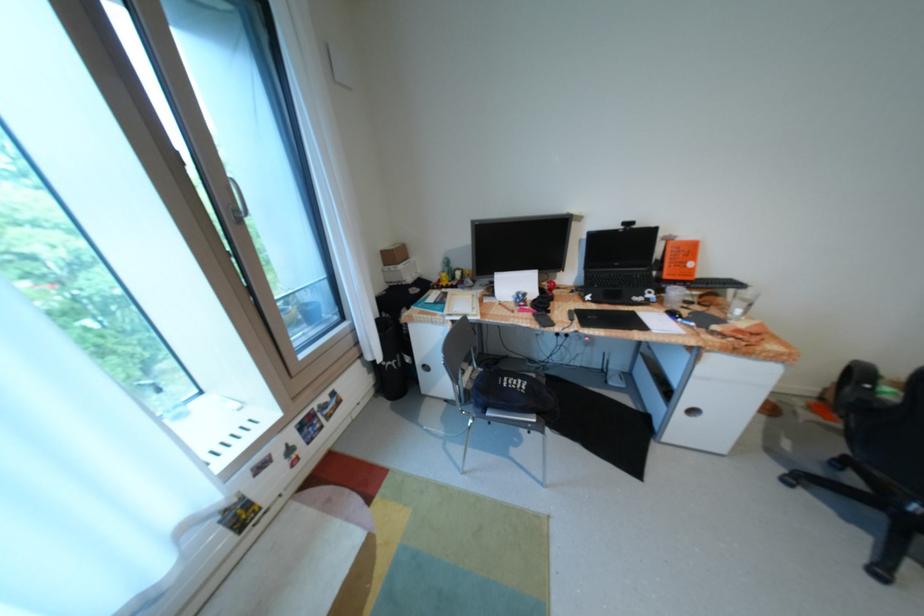
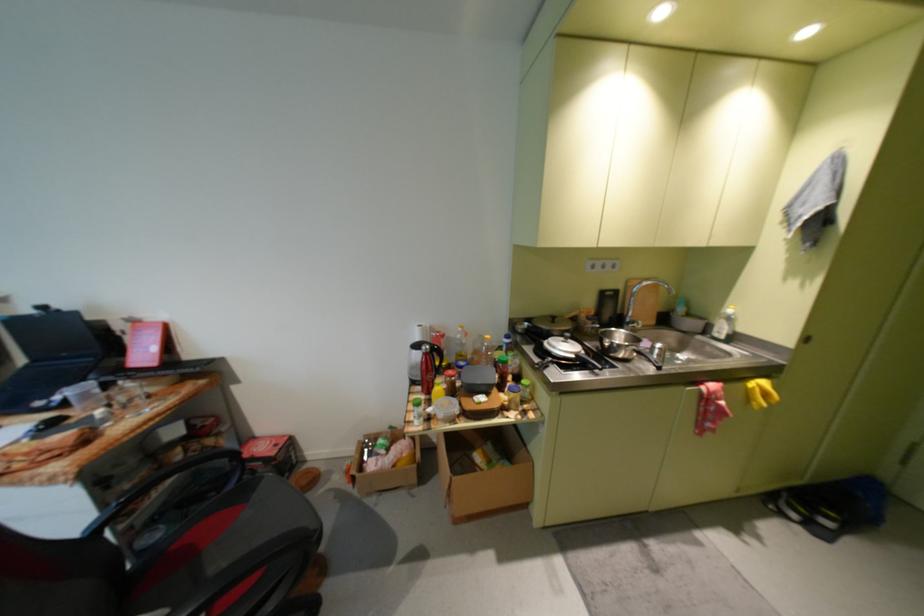
Question: Which direction would the cameraman need to move to produce the second image? Reply with the corresponding letter.

Choices:
 (A) Left
 (B) Right
 (C) Forward
 (D) Backward

Answer: (B)